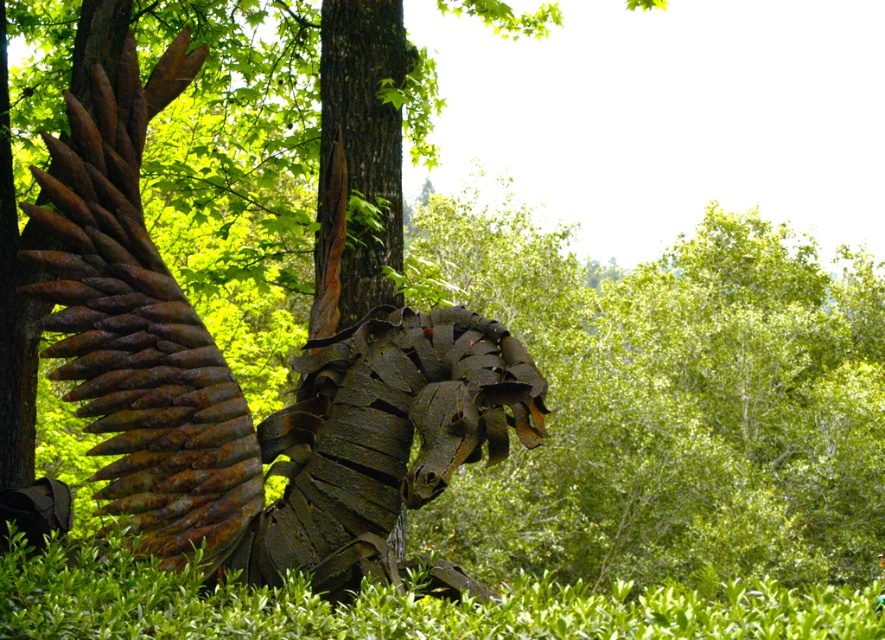
From the picture: You are a gardener who wants to plant a new flower bed between the rusty metal sculpture at center and the green leafy hedge at lower center. Can you do this without moving either object?

The rusty metal sculpture at center is positioned over the green leafy hedge at lower center, so there is no space between them to plant a flower bed without moving either object.

You are a gardener who needs to trim the green leafy hedge at lower center. The rusty metal sculpture at center is in the way. Can you safely trim the hedge without getting too close to the sculpture?

The rusty metal sculpture at center is 5.18 feet away from the green leafy hedge at lower center. Since most hedge trimmers require a minimum of 3 feet of space to operate safely, you can trim the hedge safely while maintaining a safe distance from the sculpture.

You are a photographer wanting to capture the rusty metal sculpture at center against the green leafy hedge at lower center. However, you notice that the hedge is partially obscuring the sculpture. Can you adjust your position to ensure the sculpture is fully visible without the hedge blocking it?

The green leafy hedge at lower center is behind the rusty metal sculpture at center, so moving your position to the side or adjusting the angle should allow you to frame the sculpture without the hedge blocking it.